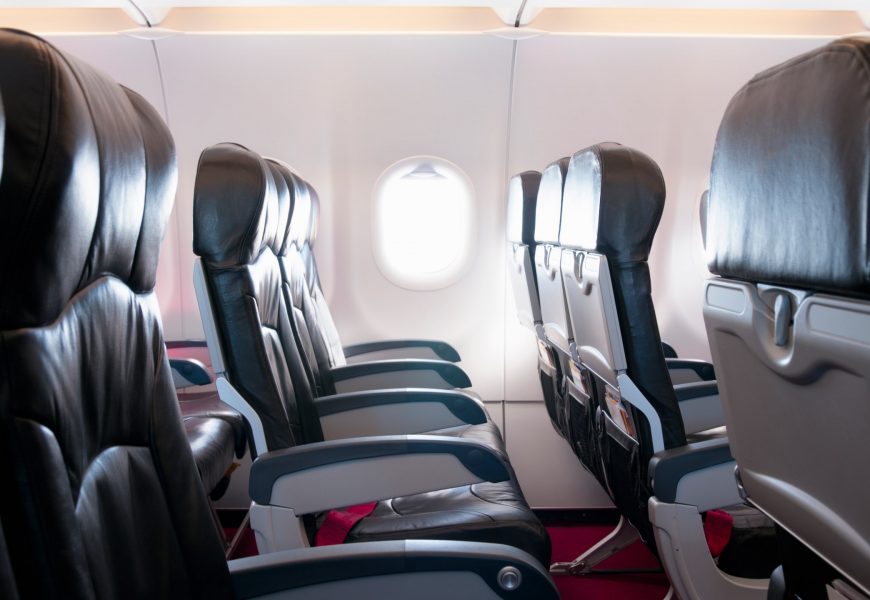
The image size is (870, 600). In order to click on chairs in this screenshot , I will do `click(72, 196)`, `click(251, 205)`, `click(308, 210)`, `click(289, 219)`, `click(523, 214)`, `click(547, 215)`, `click(604, 213)`, `click(783, 205)`, `click(205, 432)`, `click(206, 404)`.